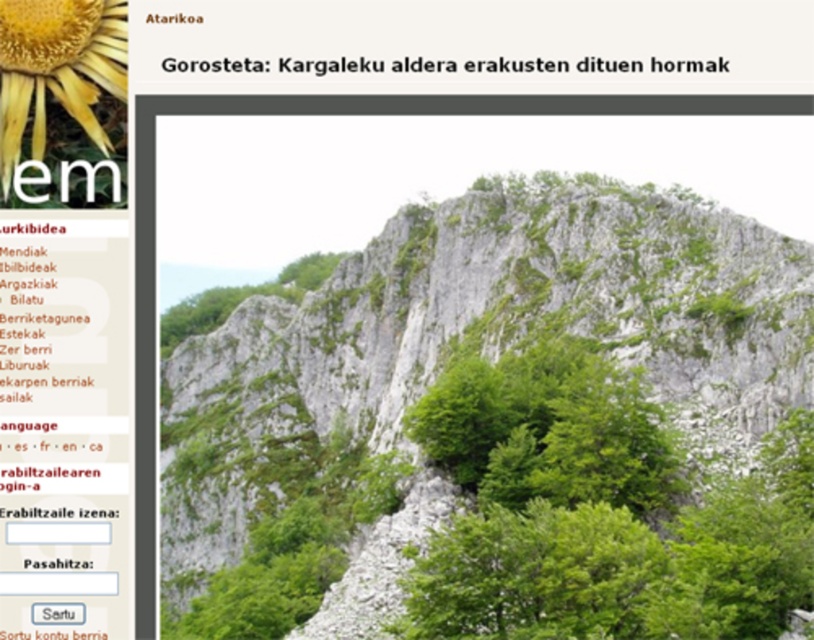
Between green leafy trees at center and green leafy trees at upper center, which one is positioned lower?

green leafy trees at center is lower down.

Can you confirm if green leafy trees at center is positioned to the right of green leafy trees at upper center?

Correct, you'll find green leafy trees at center to the right of green leafy trees at upper center.

I want to click on green leafy trees at center, so [335, 115].

Who is positioned more to the right, yellow matte flower at upper left or green leafy trees at upper center?

From the viewer's perspective, green leafy trees at upper center appears more on the right side.

Does point (84, 125) come behind point (668, 64)?

No, it is not.

Does point (16, 16) come farther from viewer compared to point (659, 61)?

No, (16, 16) is closer to viewer.

This screenshot has width=814, height=640. I want to click on yellow matte flower at upper left, so click(57, 67).

Which is behind, point (147, 106) or point (31, 45)?

The point (147, 106) is more distant.

Does point (152, 449) come closer to viewer compared to point (75, 3)?

No, (152, 449) is behind (75, 3).

Where is `green leafy trees at center`? green leafy trees at center is located at coordinates (335, 115).